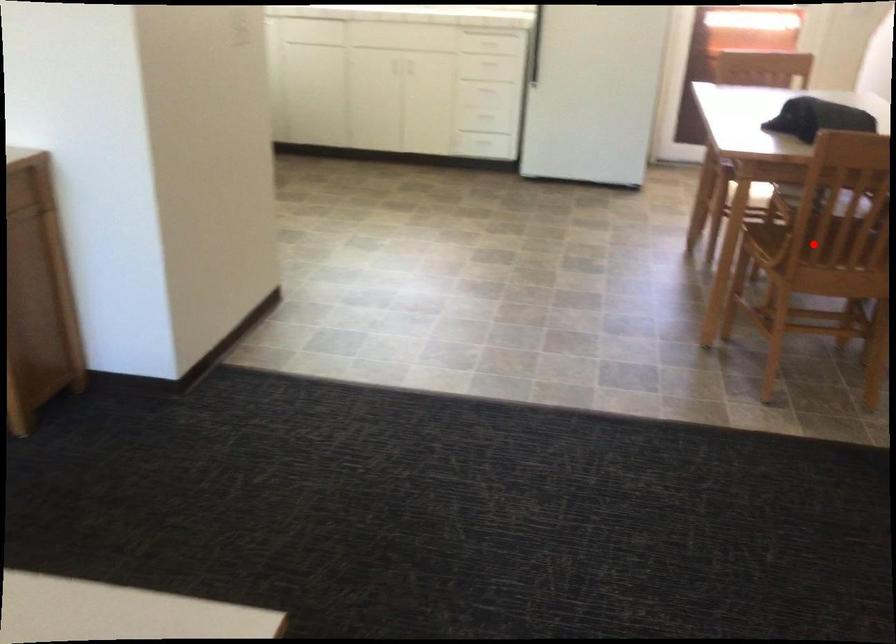
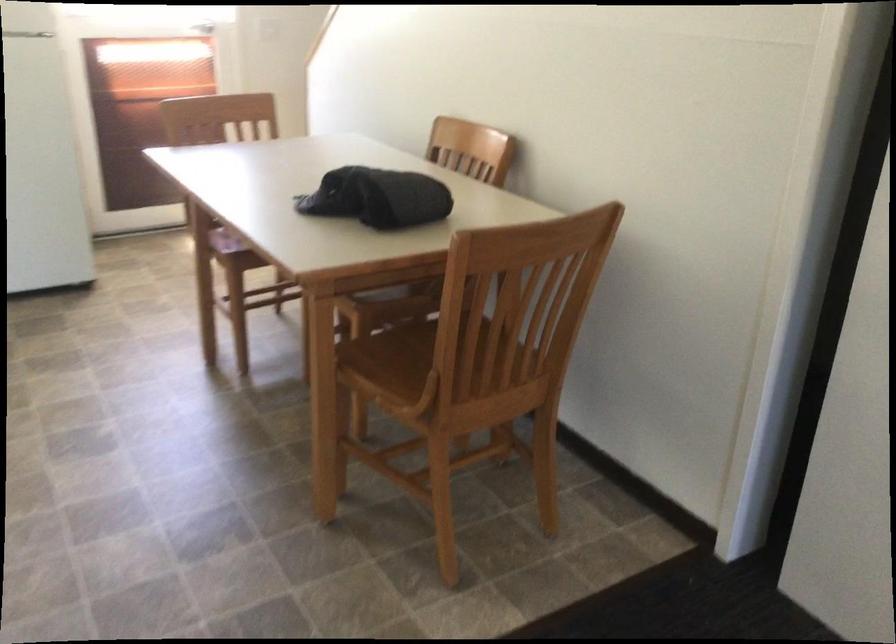
Where in the second image is the point corresponding to the highlighted location from the first image?

(421, 361)